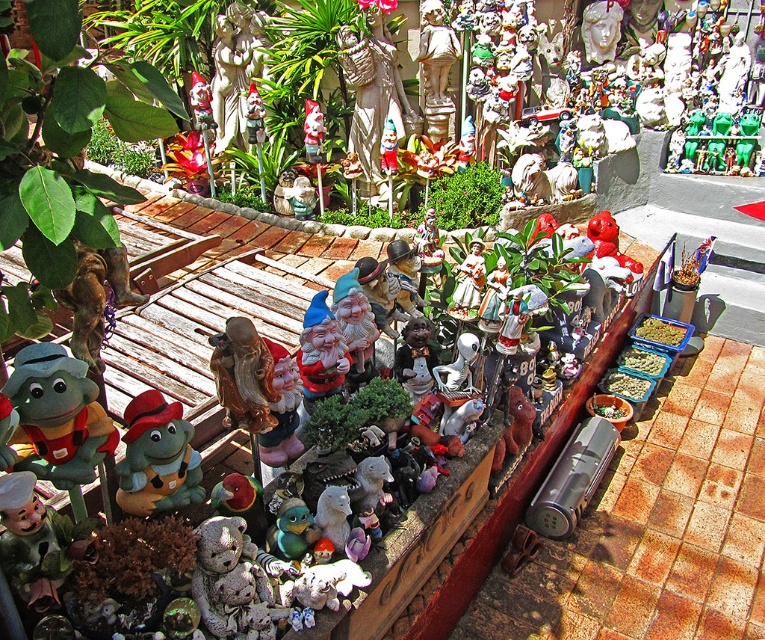
Question: Does green plush frog at left have a larger size compared to matte white figurine at center?

Choices:
 (A) no
 (B) yes

Answer: (B)

Question: Can you confirm if green plush frog at left is positioned below matte white figurine at center?

Choices:
 (A) yes
 (B) no

Answer: (A)

Question: Which point is farther from the camera taking this photo?

Choices:
 (A) (479, 280)
 (B) (77, 404)
 (C) (174, 465)

Answer: (A)

Question: Estimate the real-world distances between objects in this image. Which object is farther from the green plush frog at left?

Choices:
 (A) plush green toy at center
 (B) matte white figurine at center

Answer: (B)

Question: Is the position of plush green toy at center more distant than that of matte white figurine at center?

Choices:
 (A) yes
 (B) no

Answer: (B)

Question: Which of the following is the farthest from the observer?

Choices:
 (A) (x=155, y=502)
 (B) (x=471, y=241)

Answer: (B)